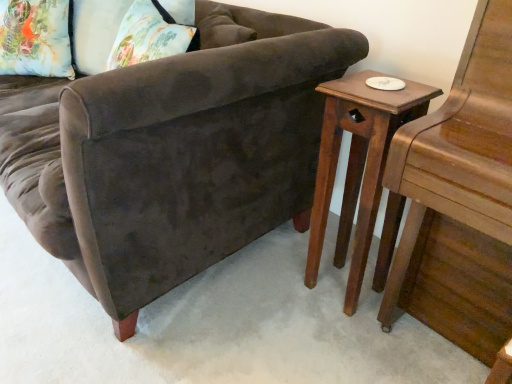
In order to click on vacant region to the left of wooden side table at right in this screenshot , I will do `click(277, 286)`.